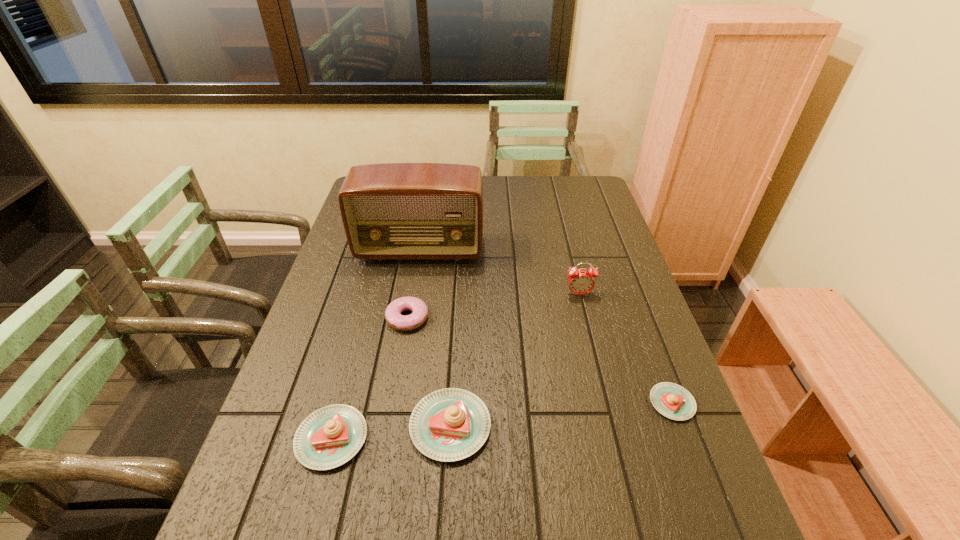
Where is `the farthest object`? Image resolution: width=960 pixels, height=540 pixels. the farthest object is located at coordinates (391, 211).

This screenshot has height=540, width=960. Identify the location of free location located 0.070m on the back of the leftmost pastry. (348, 381).

Where is `vacant space positioned on the left of the second pastry from right to left`? This screenshot has width=960, height=540. vacant space positioned on the left of the second pastry from right to left is located at coordinates (377, 426).

The height and width of the screenshot is (540, 960). I want to click on free space located on the front of the shortest object, so click(x=687, y=444).

The image size is (960, 540). I want to click on free spot located on the back of the second shortest object, so click(x=419, y=253).

Find the location of a particular element. vacant space situated 0.080m on the face of the second object from right to left is located at coordinates (585, 319).

The width and height of the screenshot is (960, 540). Identify the location of free space located on the front-facing side of the tallest object. click(404, 346).

Locate an element on the screen. pastry present at the left edge is located at coordinates (329, 437).

This screenshot has width=960, height=540. In order to click on radio receiver located in the left edge section of the desktop in this screenshot , I will do `click(391, 211)`.

Locate an element on the screen. The width and height of the screenshot is (960, 540). pastry at the right edge is located at coordinates pyautogui.click(x=673, y=401).